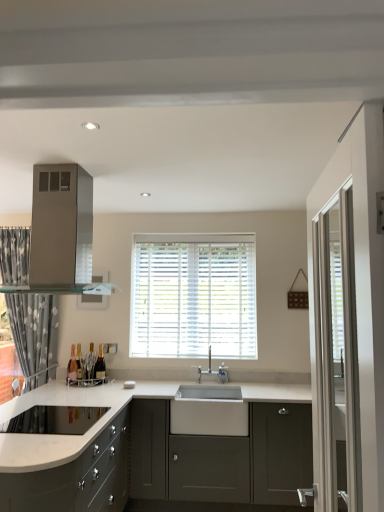
Where is `free point above white matte sink at center (from a real-world perspective)`? This screenshot has width=384, height=512. free point above white matte sink at center (from a real-world perspective) is located at coordinates (221, 385).